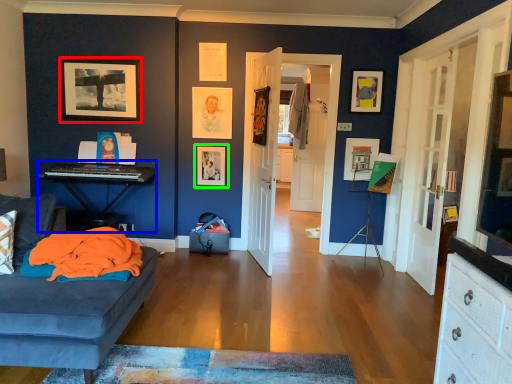
Question: Which object is the closest to the picture frame (highlighted by a red box)? Choose among these: computer desk (highlighted by a blue box) or picture frame (highlighted by a green box).

Choices:
 (A) computer desk
 (B) picture frame

Answer: (A)